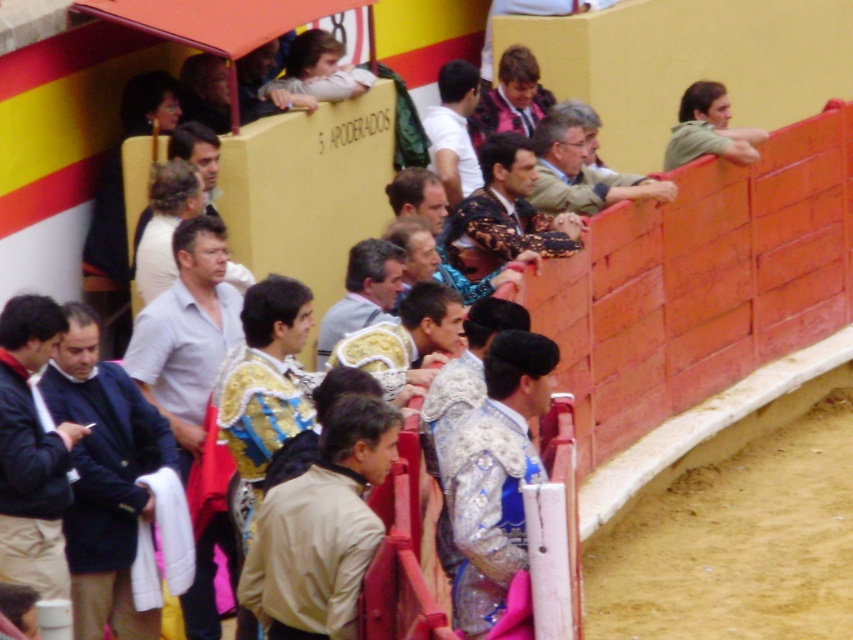
Describe the element at coordinates (321, 529) in the screenshot. Image resolution: width=853 pixels, height=640 pixels. I see `light brown leather jacket at center` at that location.

Is point (340, 410) closer to camera compared to point (514, 388)?

Yes, point (340, 410) is in front of point (514, 388).

You are a GUI agent. You are given a task and a screenshot of the screen. Output one action in this format:
    pyautogui.click(x=<x>, y=<y>)
    Task: Click on the light brown leather jacket at center
    
    Given the screenshot: What is the action you would take?
    pyautogui.click(x=321, y=529)

Locate an element on the screen. The width and height of the screenshot is (853, 640). light brown leather jacket at center is located at coordinates (321, 529).

Is floral-patterned jacket at center to the left of gold textured vest at center from the viewer's perspective?

No, floral-patterned jacket at center is not to the left of gold textured vest at center.

Between point (502, 188) and point (357, 316), which one is positioned in front?

Positioned in front is point (357, 316).

You are a GUI agent. You are given a task and a screenshot of the screen. Output one action in this format:
    pyautogui.click(x=<x>, y=<y>)
    Task: Click on the floral-patterned jacket at center
    This screenshot has height=640, width=853.
    Given the screenshot: What is the action you would take?
    pyautogui.click(x=505, y=212)

Who is shorter, dark blue suit at center or gold textured vest at center?

Standing shorter between the two is gold textured vest at center.

Is dark blue suit at center above gold textured vest at center?

No.

Does point (90, 524) come farther from viewer compared to point (329, 333)?

No.

Where is `dark blue suit at center`? The height and width of the screenshot is (640, 853). dark blue suit at center is located at coordinates (106, 481).